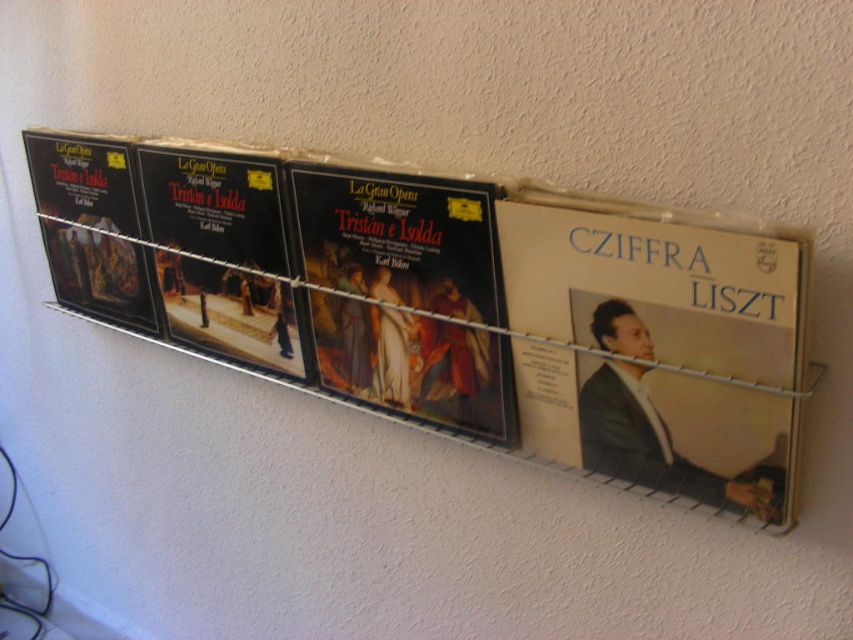
You are organizing a music collection and want to place the black vinyl record at center and the matte black vinyl record at left on a shelf. Which one should you place first to ensure they fit properly?

The black vinyl record at center is smaller than the matte black vinyl record at left, so you should place the matte black vinyl record at left first to accommodate its larger size before placing the smaller one.

You are organizing a music collection and need to know the height of the black vinyl record at center and the matte black vinyl record at left. Which one is taller?

The matte black vinyl record at left is taller than the black vinyl record at center.